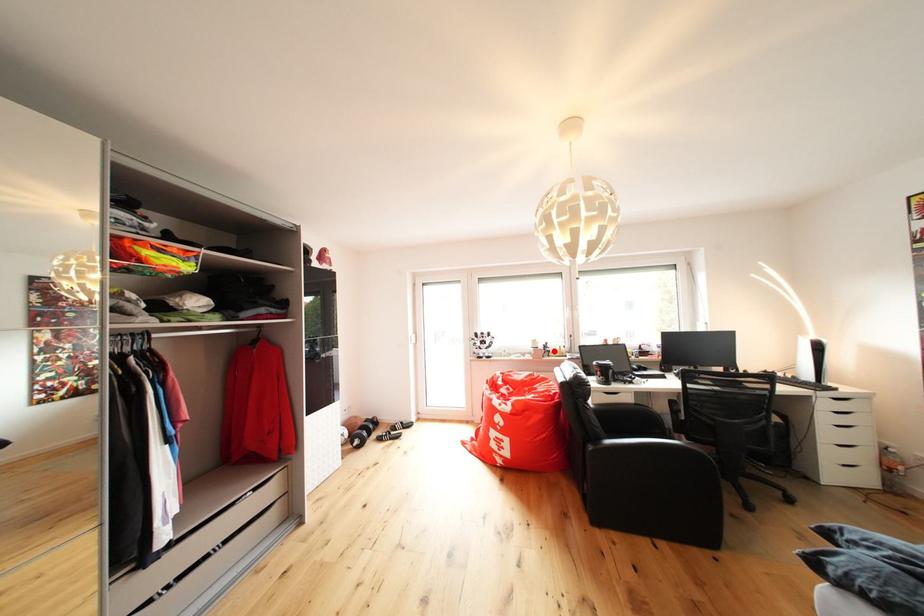
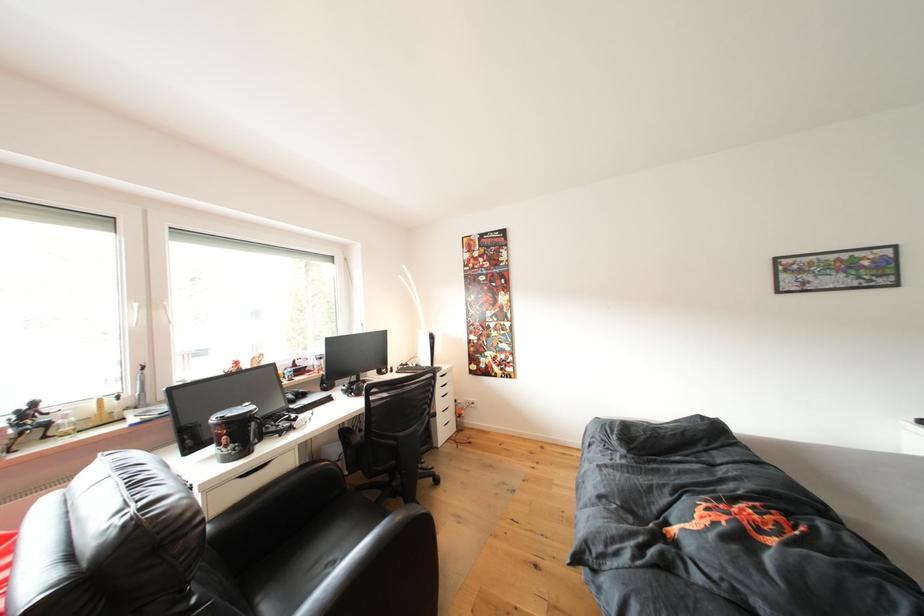
Question: I am providing you with two images of the same scene from different viewpoints. Given a red point in image1, look at the same physical point in image2. Is it:

Choices:
 (A) Closer to the viewpoint
 (B) Farther from the viewpoint

Answer: (A)